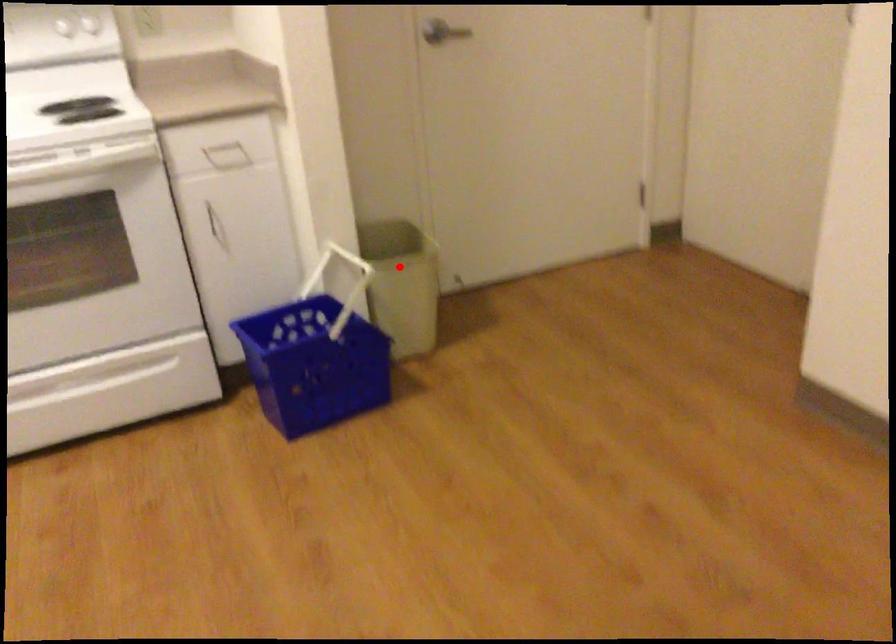
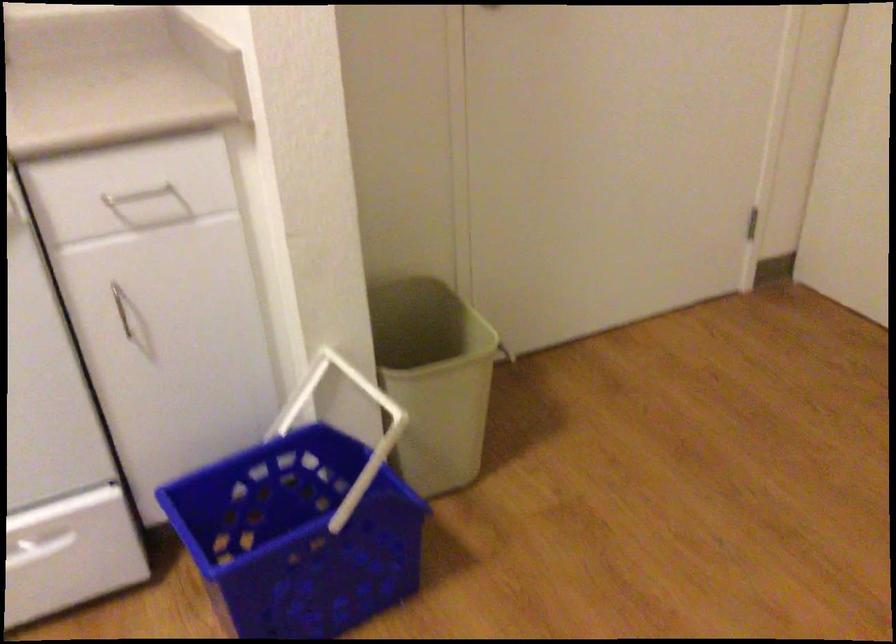
Question: I am providing you with two images of the same scene from different viewpoints. Image1 has a red point marked. In image2, the corresponding 3D location appears at what relative position? Reply with the corresponding letter.

Choices:
 (A) Closer
 (B) Farther

Answer: (A)